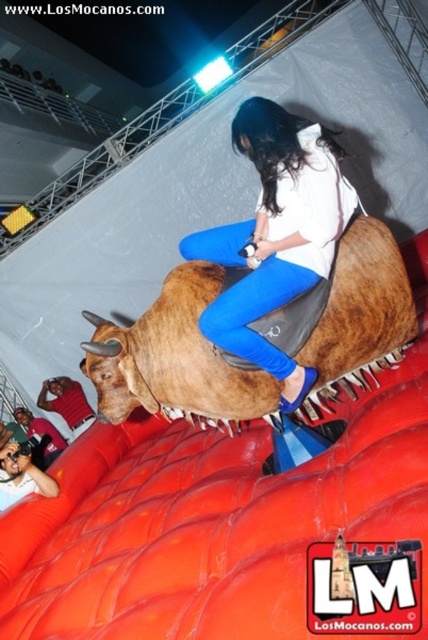
You are a photographer at the rodeo event and want to capture a closeup of the matte white shirt at center. Where exactly should you position your camera to ensure the shirt is in the center of your photo?

To capture the matte white shirt at center in the center of your photo, position your camera directly facing the coordinates point (276, 236) where the shirt is located.

Consider the image. You are a photographer standing at the back of the rodeo area. You want to take a photo of the brown leather bull at center and the smooth skin face at lower left in the same frame. What is the minimum distance you need to move forward to ensure both subjects are in your camera view?

The minimum distance you need to move forward is 1.58 meters to ensure both the brown leather bull at center and the smooth skin face at lower left are in your camera view.

You are a photographer at the rodeo event. You need to capture a photo of the matte white shirt at center and the smooth skin face at lower left. Can you position yourself so that both subjects are visible in the frame without any obstruction?

The matte white shirt at center is positioned on the right side of smooth skin face at lower left, so yes, you can position yourself to the left of both subjects to ensure both are visible in the frame without obstruction.